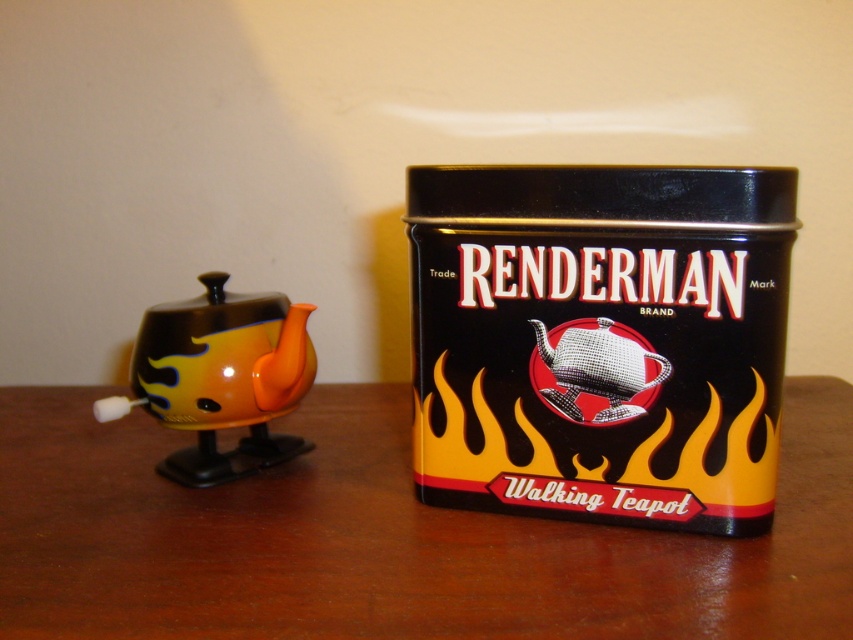
Which is more to the right, wooden table at center or shiny metallic teapot at center?

From the viewer's perspective, shiny metallic teapot at center appears more on the right side.

Which of these two, wooden table at center or shiny metallic teapot at center, stands taller?

wooden table at center

The image size is (853, 640). What are the coordinates of `wooden table at center` in the screenshot? It's located at (387, 538).

Looking at this image, does wooden table at center come behind orange glossy teapot at left?

No.

Consider the image. Does wooden table at center have a larger size compared to orange glossy teapot at left?

Yes, wooden table at center is bigger than orange glossy teapot at left.

Does point (38, 465) come in front of point (234, 321)?

No, (38, 465) is behind (234, 321).

Identify the location of wooden table at center. The image size is (853, 640). (387, 538).

Does orange glossy teapot at left appear under shiny metallic teapot at center?

Yes, orange glossy teapot at left is below shiny metallic teapot at center.

Locate an element on the screen. orange glossy teapot at left is located at coordinates (219, 378).